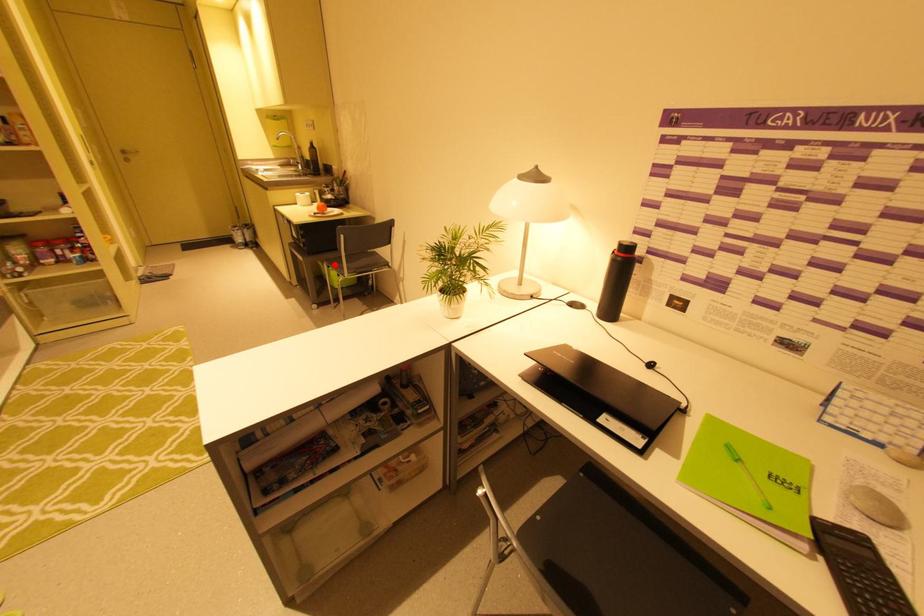
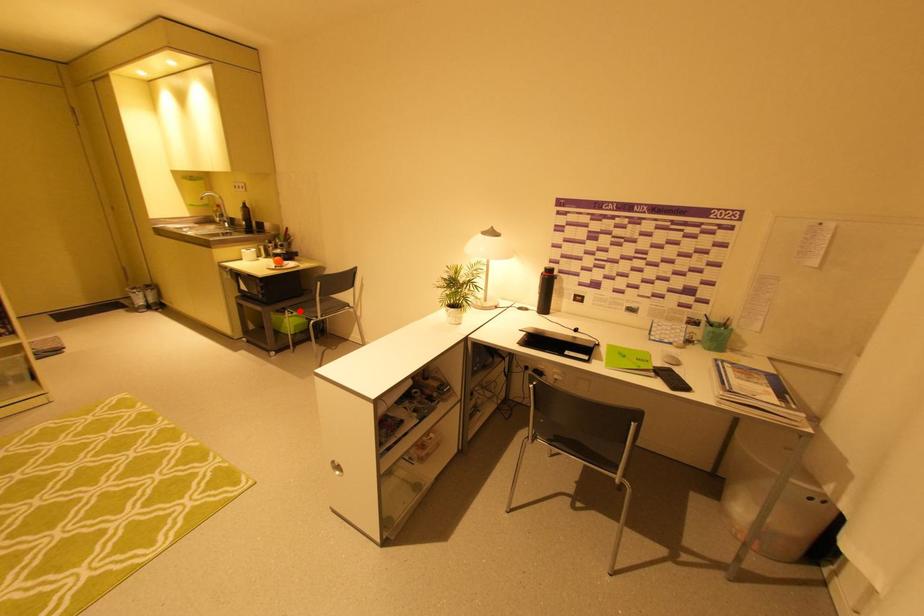
I am providing you with two images of the same scene from different viewpoints. A red point is marked on the first image and another point is marked on the second image. Does the point marked in image1 correspond to the same location as the one in image2?

Yes